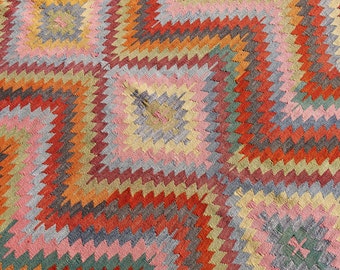
Find the location of a particular element. orange yarn used to make rug or blanket is located at coordinates (79, 197), (11, 146).